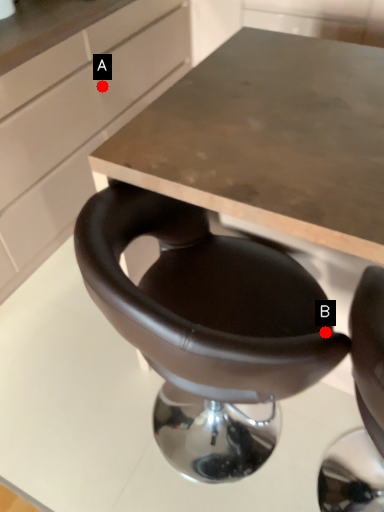
Question: Two points are circled on the image, labeled by A and B beside each circle. Among these points, which one is farthest from the camera?

Choices:
 (A) A is further
 (B) B is further

Answer: (A)